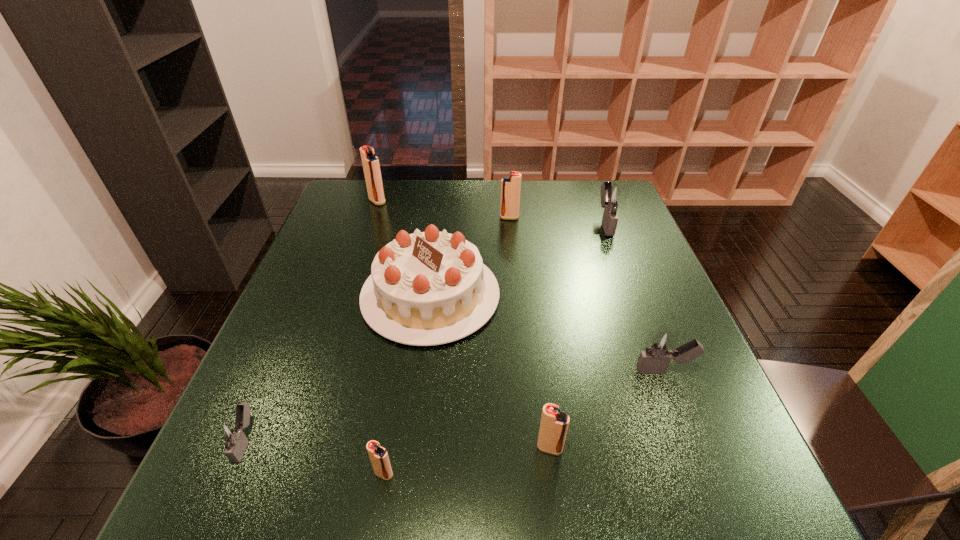
At what (x,y) coordinates should I click in order to perform the action: click on object present at the near edge. Please return your answer as a coordinate pair (x, y). Looking at the image, I should click on (378, 455).

Locate an element on the screen. The height and width of the screenshot is (540, 960). object located in the far left corner section of the desktop is located at coordinates (371, 166).

At what (x,y) coordinates should I click in order to perform the action: click on object positioned at the far right corner. Please return your answer as a coordinate pair (x, y). The image size is (960, 540). Looking at the image, I should click on (613, 196).

In the image, there is a desktop. Identify the location of vacant space at the far edge. This screenshot has width=960, height=540. (456, 201).

In the image, there is a desktop. Identify the location of vacant space at the near edge. This screenshot has height=540, width=960. (665, 511).

What are the coordinates of `free space at the left edge of the desktop` in the screenshot? It's located at (306, 291).

Where is `blank space at the right edge of the desktop`? The image size is (960, 540). blank space at the right edge of the desktop is located at coordinates (635, 313).

I want to click on free spot at the far left corner of the desktop, so click(349, 195).

Identify the location of vacant area at the far right corner of the desktop. This screenshot has height=540, width=960. (597, 214).

Where is `empty space between the farthest red igniter and the leftmost igniter`? This screenshot has height=540, width=960. empty space between the farthest red igniter and the leftmost igniter is located at coordinates (312, 321).